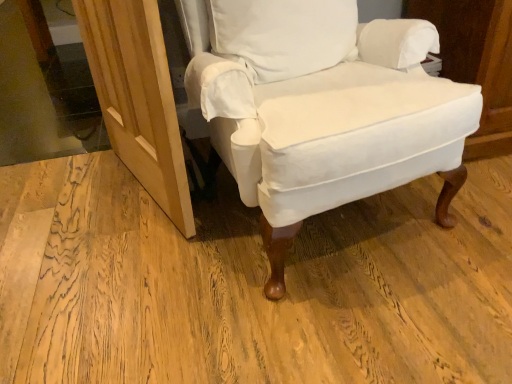
Question: Looking at their shapes, would you say white cotton pillow at center is wider or thinner than white cotton chair at center?

Choices:
 (A) wide
 (B) thin

Answer: (B)

Question: From a real-world perspective, is white cotton pillow at center above or below white cotton chair at center?

Choices:
 (A) below
 (B) above

Answer: (B)

Question: Which of these objects is positioned closest to the natural wood screen door at lower left?

Choices:
 (A) white cotton chair at center
 (B) white cotton pillow at center
 (C) transparent glass door at upper left

Answer: (A)

Question: Considering the real-world distances, which object is farthest from the white cotton chair at center?

Choices:
 (A) natural wood screen door at lower left
 (B) white cotton pillow at center
 (C) transparent glass door at upper left

Answer: (C)